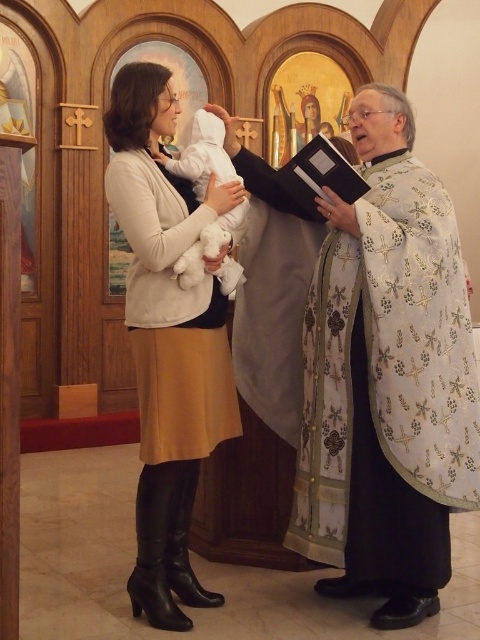
From the picture: Can you confirm if white embroidered robe at right is positioned below white plush at center?

Indeed, white embroidered robe at right is positioned under white plush at center.

Is white embroidered robe at right closer to camera compared to white plush at center?

Yes, it is.

I want to click on white embroidered robe at right, so click(x=387, y=387).

Does white embroidered robe at right appear on the right side of matte white sweater at center?

Correct, you'll find white embroidered robe at right to the right of matte white sweater at center.

Find the location of a particular element. The width and height of the screenshot is (480, 640). white embroidered robe at right is located at coordinates (387, 387).

This screenshot has height=640, width=480. What are the coordinates of `white embroidered robe at right` in the screenshot? It's located at (387, 387).

Who is taller, matte white sweater at center or white plush at center?

matte white sweater at center is taller.

Does matte white sweater at center have a larger size compared to white plush at center?

Yes, matte white sweater at center is bigger than white plush at center.

Between point (175, 216) and point (214, 250), which one is positioned in front?

Point (214, 250) is more forward.

Locate an element on the screen. Image resolution: width=480 pixels, height=640 pixels. matte white sweater at center is located at coordinates pyautogui.click(x=168, y=340).